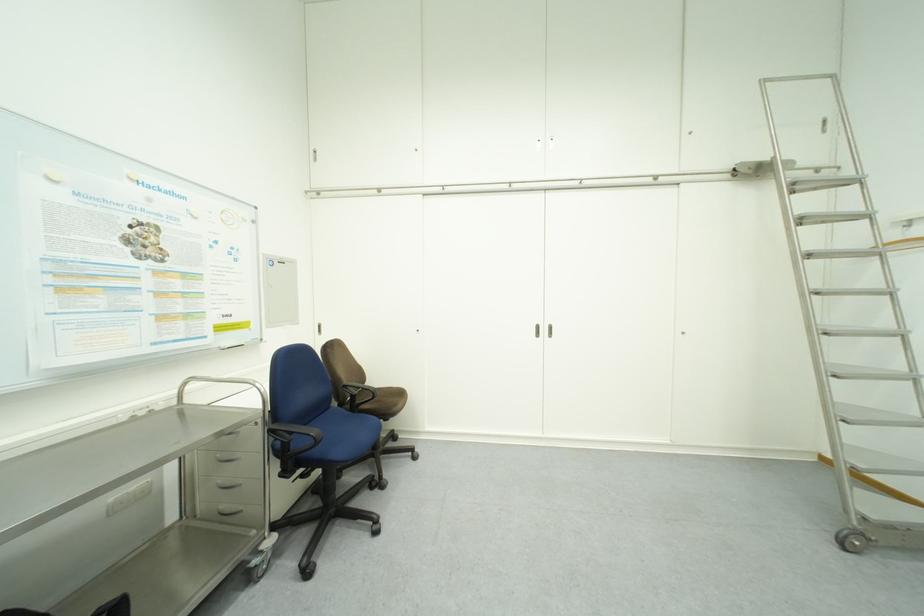
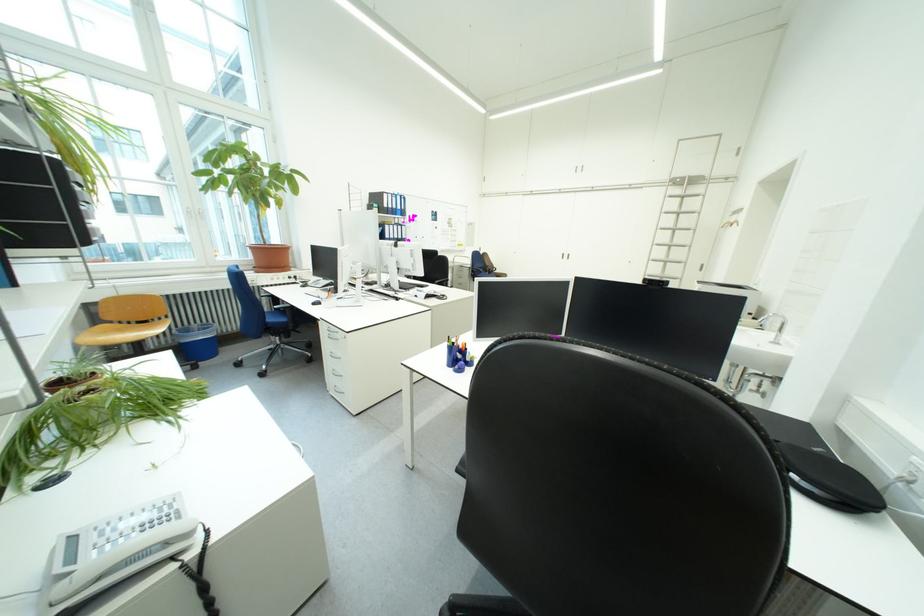
Where in the second image is the point corresponding to point (554, 333) from the first image?

(577, 257)